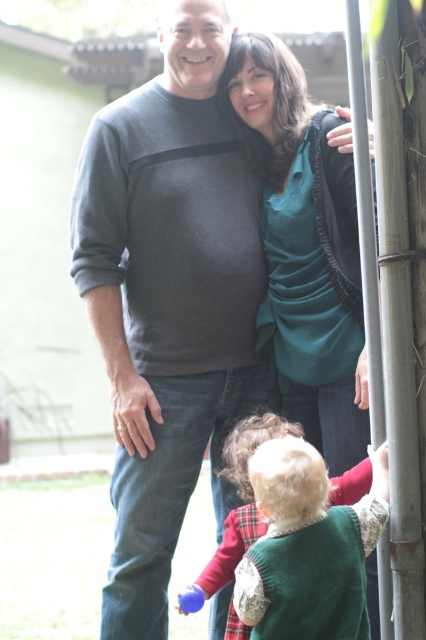
Does teal satin blouse at center have a larger size compared to rubber blue ball at lower center?

Yes, teal satin blouse at center is bigger than rubber blue ball at lower center.

Does teal satin blouse at center come in front of rubber blue ball at lower center?

That is False.

The height and width of the screenshot is (640, 426). In order to click on teal satin blouse at center in this screenshot , I will do 302,244.

In the scene shown: Does teal satin blouse at center have a greater height compared to green fuzzy vest at lower center?

Indeed, teal satin blouse at center has a greater height compared to green fuzzy vest at lower center.

Is point (348, 436) closer to camera compared to point (362, 468)?

No, it is not.

Find the location of a particular element. This screenshot has height=640, width=426. teal satin blouse at center is located at coordinates (302, 244).

Describe the element at coordinates (169, 300) in the screenshot. I see `gray cotton sweater at center` at that location.

Is gray cotton sweater at center positioned at the back of green fuzzy vest at lower center?

That is True.

Locate an element on the screen. gray cotton sweater at center is located at coordinates (x=169, y=300).

Identify the location of gray cotton sweater at center. The height and width of the screenshot is (640, 426). tap(169, 300).